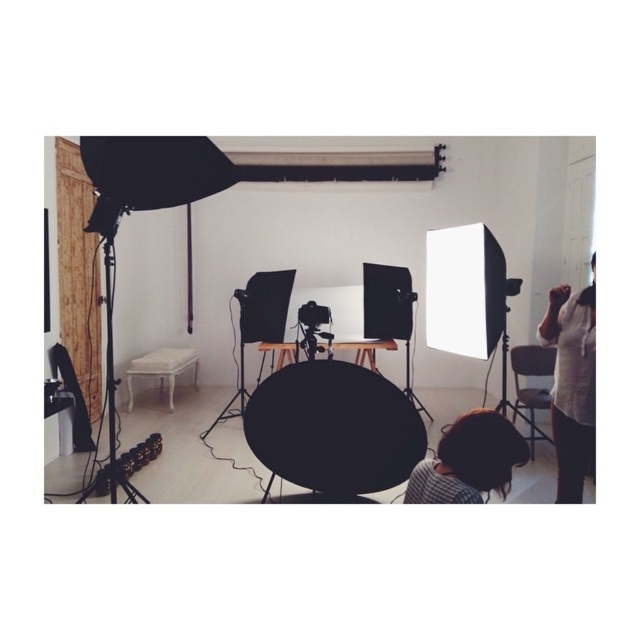
Question: Does matte black backdrop at center come in front of white cotton shirt at right?

Choices:
 (A) yes
 (B) no

Answer: (B)

Question: Estimate the real-world distances between objects in this image. Which object is farther from the white cotton shirt at right?

Choices:
 (A) brown hair at lower center
 (B) black matte tripod at center

Answer: (B)

Question: Which object appears farthest from the camera in this image?

Choices:
 (A) brown hair at lower center
 (B) matte black backdrop at center

Answer: (B)

Question: Which point is farther to the camera?

Choices:
 (A) matte black backdrop at center
 (B) white cotton shirt at right

Answer: (A)

Question: Does matte black backdrop at center lie behind brown hair at lower center?

Choices:
 (A) yes
 (B) no

Answer: (A)

Question: Observing the image, what is the correct spatial positioning of matte black backdrop at center in reference to white cotton shirt at right?

Choices:
 (A) right
 (B) left

Answer: (B)